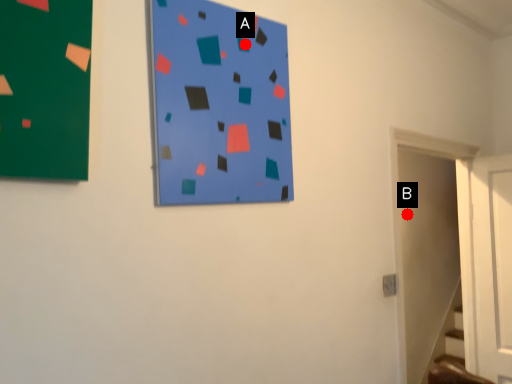
Question: Two points are circled on the image, labeled by A and B beside each circle. Which point is closer to the camera taking this photo?

Choices:
 (A) A is closer
 (B) B is closer

Answer: (A)